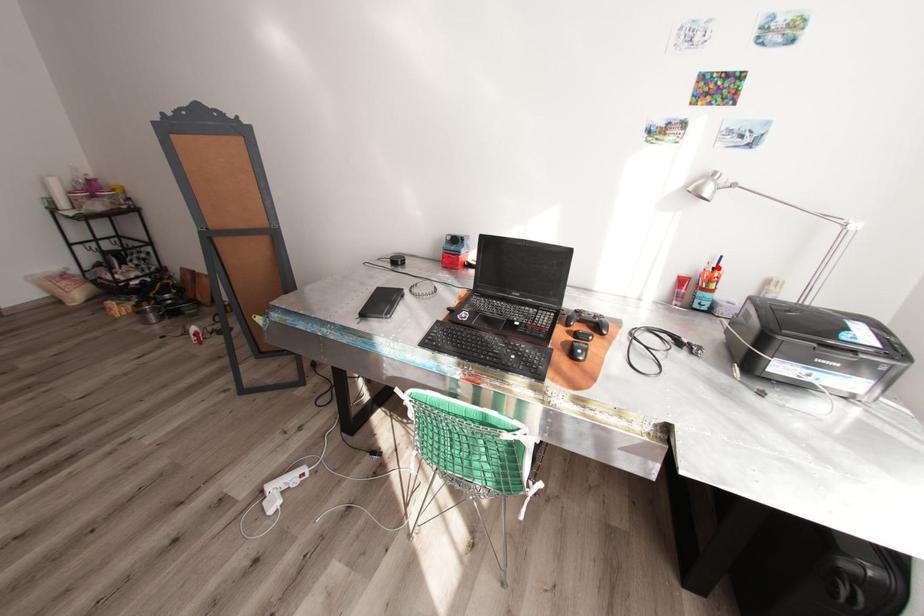
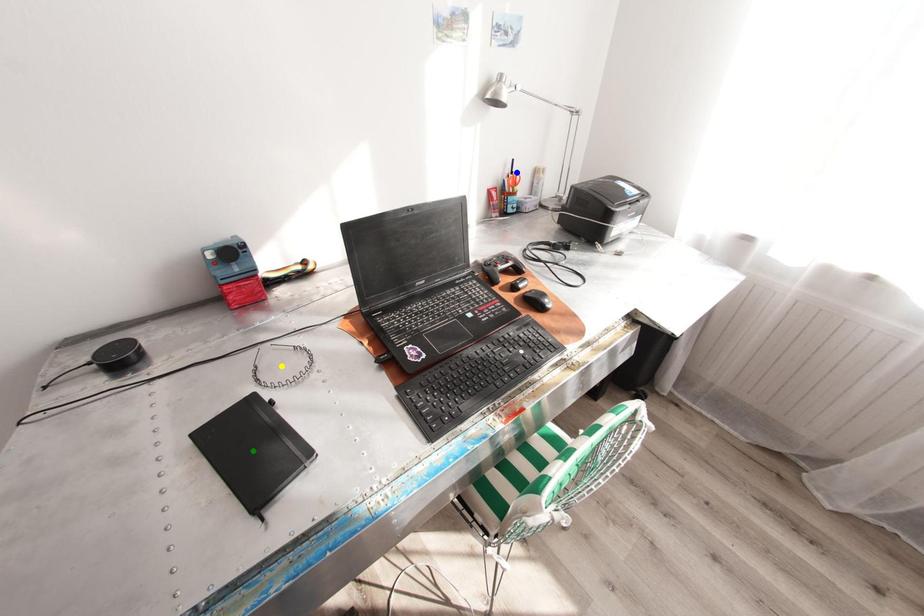
Question: I am providing you with two images of the same scene from different viewpoints. A red point is marked on the first image. You are given multiple points on the second image. Which mark in image 2 goes with the point in image 1?

Choices:
 (A) yellow point
 (B) green point
 (C) blue point

Answer: (C)